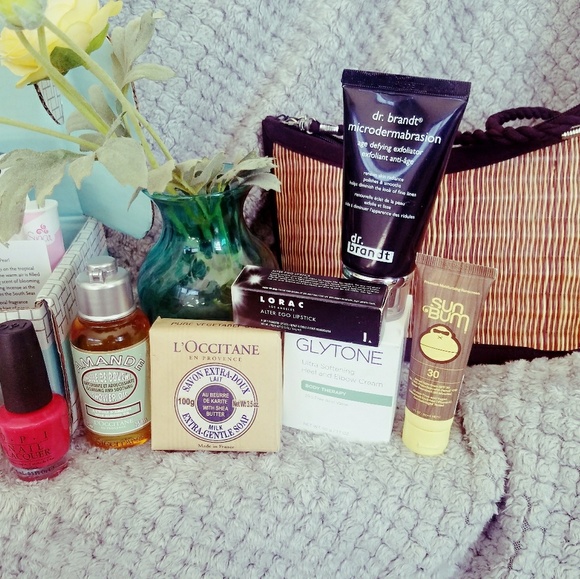
Locate an element on the screen. This screenshot has height=579, width=580. plant is located at coordinates (158, 167).